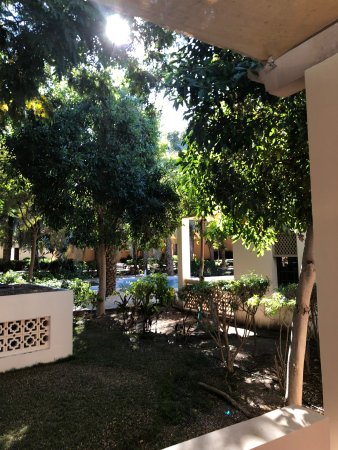
Where is `beam`? This screenshot has width=338, height=450. beam is located at coordinates (183, 235).